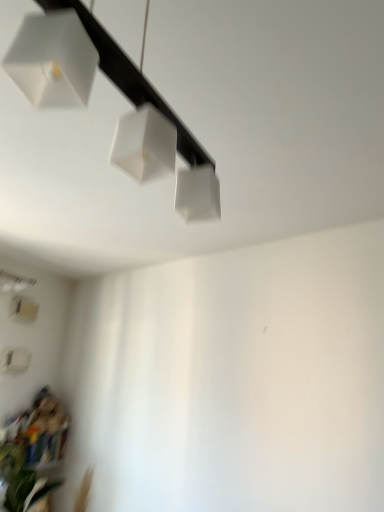
Identify the location of green leafy plant at lower left. (21, 480).

Between white matte lampshade at lower left, arranged as the first lamp when viewed from the back, and green leafy plant at lower left, which one has more height?

With more height is white matte lampshade at lower left, arranged as the first lamp when viewed from the back.

Would you consider white matte lampshade at lower left, arranged as the first lamp when viewed from the back, to be distant from green leafy plant at lower left?

That's right, there is a large distance between white matte lampshade at lower left, arranged as the first lamp when viewed from the back, and green leafy plant at lower left.

Measure the distance from white matte lampshade at lower left, arranged as the first lamp when viewed from the back, to green leafy plant at lower left.

white matte lampshade at lower left, arranged as the first lamp when viewed from the back, and green leafy plant at lower left are 1.11 meters apart from each other.

Is the depth of white matte lampshade at lower left, positioned as the first lamp in left-to-right order, less than that of green leafy plant at lower left?

No.

Looking at this image, is green leafy plant at lower left wider than white matte lampshade at lower left, which is the 2th lamp in front-to-back order?

Correct, the width of green leafy plant at lower left exceeds that of white matte lampshade at lower left, which is the 2th lamp in front-to-back order.

Is green leafy plant at lower left beside white matte lampshade at lower left, the first lamp positioned from the bottom?

No, green leafy plant at lower left is not making contact with white matte lampshade at lower left, the first lamp positioned from the bottom.

Considering the relative sizes of green leafy plant at lower left and white matte lampshade at lower left, the second lamp viewed from the right, in the image provided, is green leafy plant at lower left taller than white matte lampshade at lower left, the second lamp viewed from the right,?

No, green leafy plant at lower left is not taller than white matte lampshade at lower left, the second lamp viewed from the right.

From the image's perspective, which one is positioned lower, green leafy plant at lower left or white matte lamp at upper center, positioned as the second lamp in bottom-to-top order?

green leafy plant at lower left, from the image's perspective.

Does green leafy plant at lower left have a smaller size compared to white matte lamp at upper center, the second lamp viewed from the left?

Yes.

In the scene shown: Is green leafy plant at lower left facing towards white matte lamp at upper center, acting as the first lamp starting from the top?

No, green leafy plant at lower left is not aimed at white matte lamp at upper center, acting as the first lamp starting from the top.

Which point is more forward, (19,453) or (194,214)?

The point (194,214) is closer to the camera.

Is white matte lamp at upper center, positioned as the second lamp in bottom-to-top order, not inside white matte lampshade at lower left, positioned as the first lamp in left-to-right order?

white matte lamp at upper center, positioned as the second lamp in bottom-to-top order, is positioned outside white matte lampshade at lower left, positioned as the first lamp in left-to-right order.

From a real-world perspective, relative to white matte lampshade at lower left, positioned as the first lamp in left-to-right order, is white matte lamp at upper center, acting as the first lamp starting from the top, vertically above or below?

From a real-world perspective, white matte lamp at upper center, acting as the first lamp starting from the top, is physically above white matte lampshade at lower left, positioned as the first lamp in left-to-right order.

Considering the positions of objects white matte lamp at upper center, the second lamp positioned from the back, and white matte lampshade at lower left, arranged as the first lamp when viewed from the back, in the image provided, who is behind, white matte lamp at upper center, the second lamp positioned from the back, or white matte lampshade at lower left, arranged as the first lamp when viewed from the back,?

white matte lampshade at lower left, arranged as the first lamp when viewed from the back, is further from the camera.

Is point (167, 110) closer to camera compared to point (25, 304)?

Yes.

Based on the photo, in the image, is white matte lampshade at lower left, positioned as the first lamp in left-to-right order, on the left side or the right side of white matte lamp at upper center, the second lamp viewed from the left?

white matte lampshade at lower left, positioned as the first lamp in left-to-right order, is positioned on white matte lamp at upper center, the second lamp viewed from the left,'s left side.

Is there a large distance between white matte lampshade at lower left, the first lamp positioned from the bottom, and white matte lamp at upper center, acting as the first lamp starting from the top?

white matte lampshade at lower left, the first lamp positioned from the bottom, is far away from white matte lamp at upper center, acting as the first lamp starting from the top.

Which is in front, white matte lampshade at lower left, the first lamp positioned from the bottom, or white matte lamp at upper center, which is the first lamp in front-to-back order?

white matte lamp at upper center, which is the first lamp in front-to-back order.

Can we say white matte lampshade at lower left, the second lamp viewed from the right, lies outside white matte lamp at upper center, the second lamp positioned from the back?

white matte lampshade at lower left, the second lamp viewed from the right, lies outside white matte lamp at upper center, the second lamp positioned from the back,'s area.

Is point (101, 51) positioned after point (18, 456)?

That is False.

Based on their sizes in the image, would you say white matte lamp at upper center, positioned as the second lamp in bottom-to-top order, is bigger or smaller than green leafy plant at lower left?

white matte lamp at upper center, positioned as the second lamp in bottom-to-top order, is bigger than green leafy plant at lower left.

Is white matte lamp at upper center, acting as the first lamp starting from the right, surrounding green leafy plant at lower left?

No, green leafy plant at lower left is not surrounded by white matte lamp at upper center, acting as the first lamp starting from the right.

At what (x,y) coordinates should I click in order to perform the action: click on lamp that is behind the green leafy plant at lower left. Please return your answer as a coordinate pair (x, y). Looking at the image, I should click on (24, 309).

The height and width of the screenshot is (512, 384). I want to click on plant below the white matte lampshade at lower left, the first lamp positioned from the bottom (from the image's perspective), so click(21, 480).

From the image, which object appears to be farther from white matte lampshade at lower left, arranged as the first lamp when viewed from the back, white matte lamp at upper center, the second lamp viewed from the left, or green leafy plant at lower left?

Among the two, white matte lamp at upper center, the second lamp viewed from the left, is located further to white matte lampshade at lower left, arranged as the first lamp when viewed from the back.

Estimate the real-world distances between objects in this image. Which object is further from white matte lamp at upper center, acting as the first lamp starting from the top, white matte lampshade at lower left, positioned as the first lamp in left-to-right order, or green leafy plant at lower left?

white matte lampshade at lower left, positioned as the first lamp in left-to-right order, lies further to white matte lamp at upper center, acting as the first lamp starting from the top, than the other object.

From the image, which object appears to be farther from green leafy plant at lower left, white matte lampshade at lower left, the first lamp positioned from the bottom, or white matte lamp at upper center, acting as the first lamp starting from the right?

The object further to green leafy plant at lower left is white matte lamp at upper center, acting as the first lamp starting from the right.

Based on their spatial positions, is white matte lamp at upper center, the second lamp viewed from the left, or white matte lampshade at lower left, which is the 2th lamp in front-to-back order, closer to green leafy plant at lower left?

white matte lampshade at lower left, which is the 2th lamp in front-to-back order, lies closer to green leafy plant at lower left than the other object.

Based on their spatial positions, is green leafy plant at lower left or white matte lampshade at lower left, the first lamp positioned from the bottom, closer to white matte lamp at upper center, acting as the first lamp starting from the top?

green leafy plant at lower left is closer to white matte lamp at upper center, acting as the first lamp starting from the top.

Considering their positions, is green leafy plant at lower left positioned further to white matte lampshade at lower left, positioned as the first lamp in left-to-right order, than white matte lamp at upper center, acting as the first lamp starting from the right?

Based on the image, white matte lamp at upper center, acting as the first lamp starting from the right, appears to be further to white matte lampshade at lower left, positioned as the first lamp in left-to-right order.

Locate an element on the screen. plant between white matte lamp at upper center, the second lamp positioned from the back, and white matte lampshade at lower left, the first lamp positioned from the bottom, in the front-back direction is located at coordinates (21, 480).